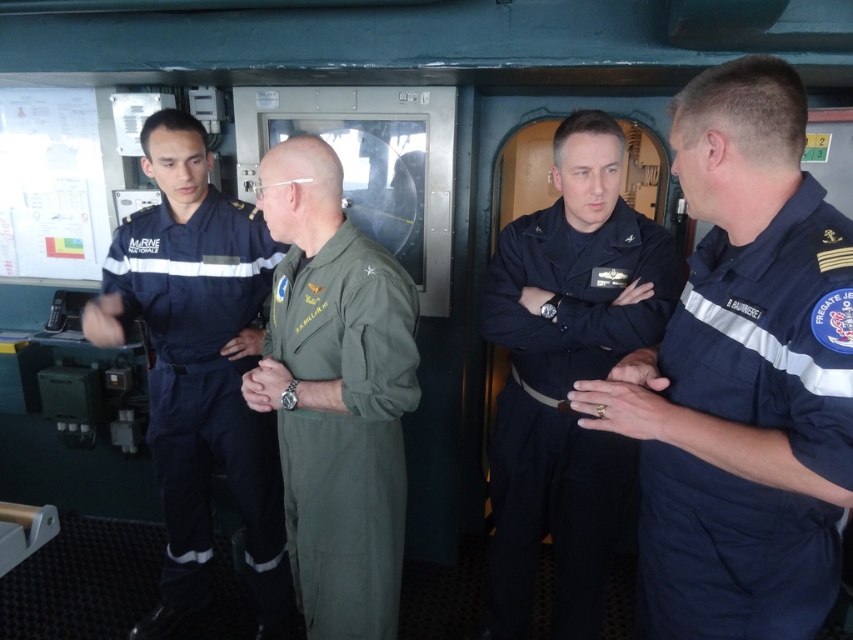
You are a photographer planning to take a group photo of the navy blue uniform at left and the green fabric jumpsuit at center. Which uniform will require a larger frame size to capture the entire person without cropping?

The navy blue uniform at left is bigger than the green fabric jumpsuit at center, so the navy blue uniform at left will require a larger frame size to capture the entire person without cropping.

Looking at this image, you are an observer in the ship control room. You need to locate the dark blue fabric uniform at center. Where exactly is it located in the room?

The dark blue fabric uniform at center is located at point (x=561, y=400) in the room.